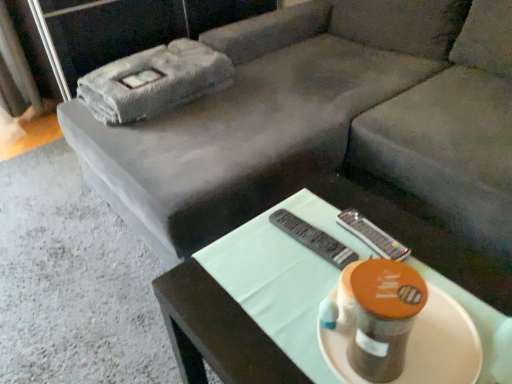
The height and width of the screenshot is (384, 512). Find the location of `free space to the back side of black plastic remote at center`. free space to the back side of black plastic remote at center is located at coordinates (314, 206).